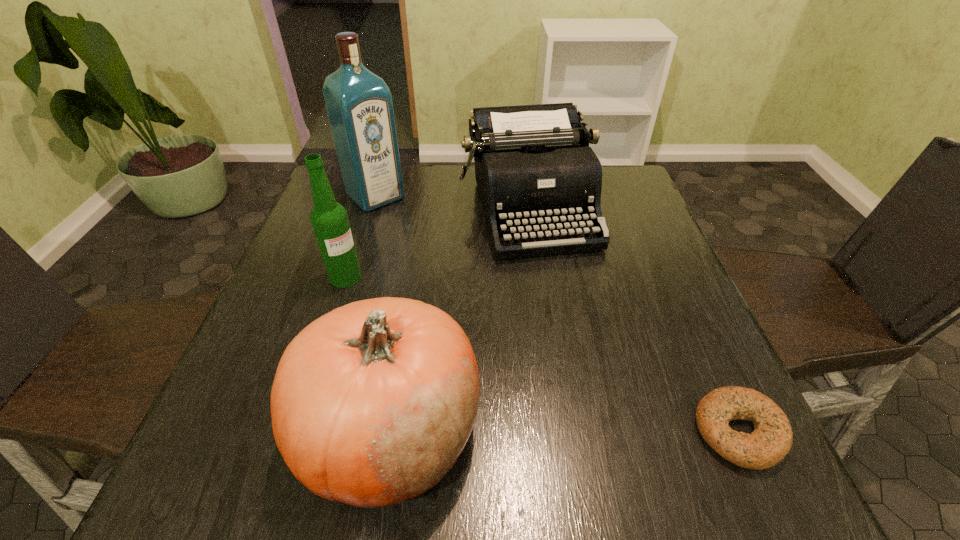
Locate an element on the screen. pumpkin is located at coordinates (372, 403).

This screenshot has height=540, width=960. Find the location of `bagel`. bagel is located at coordinates (771, 440).

Locate an element on the screen. the rightmost object is located at coordinates (771, 440).

Find the location of `typewriter`. typewriter is located at coordinates (534, 168).

Find the location of a particular element. The height and width of the screenshot is (540, 960). beer bottle is located at coordinates (329, 219).

Identify the location of the tallest object. The width and height of the screenshot is (960, 540). (359, 104).

Identify the location of free space located 0.330m on the back of the pumpkin. (420, 246).

Locate an element on the screen. The width and height of the screenshot is (960, 540). free space located on the left of the rightmost object is located at coordinates pos(603,431).

Image resolution: width=960 pixels, height=540 pixels. Identify the location of vacant space located on the typing side of the fourth tallest object. (607, 419).

Find the location of a particular element. This screenshot has height=540, width=960. vacant region located 0.230m on the typing side of the fourth tallest object is located at coordinates (577, 340).